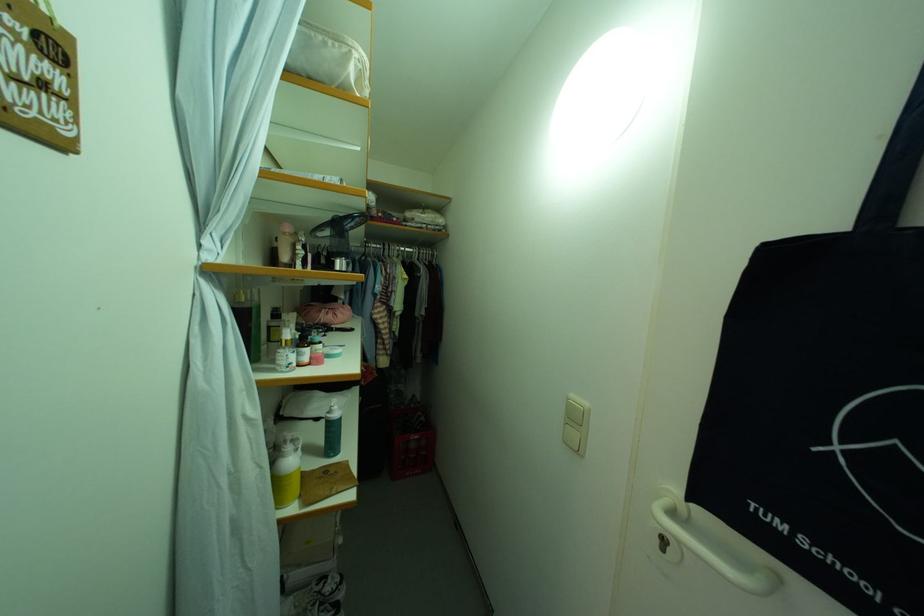
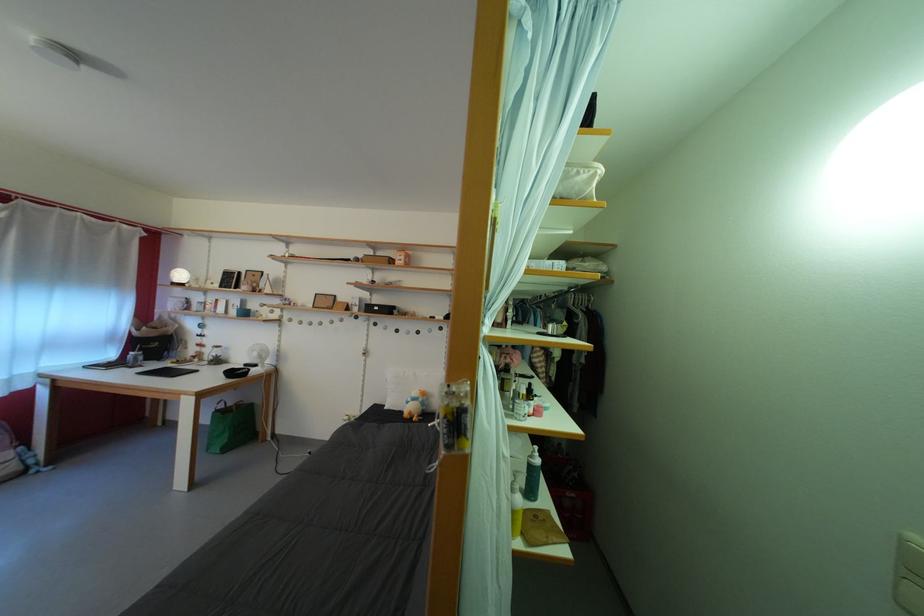
The images are taken continuously from a first-person perspective. In which direction are you moving?

The cameraman moved toward left, backward.